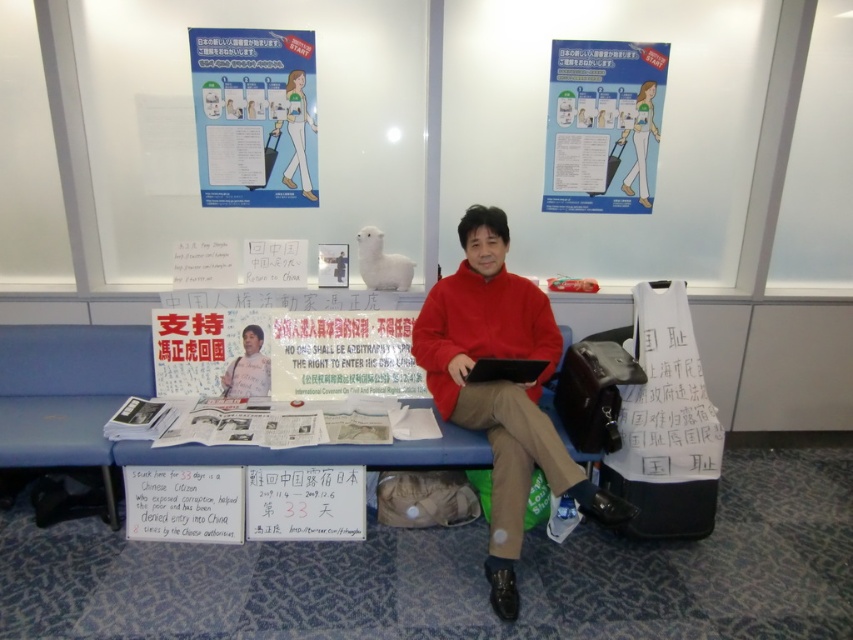
Question: Which is nearer to the blue paper poster at upper left?

Choices:
 (A) blue paper poster at upper center
 (B) matte red sweater at center
 (C) red fleece sweater at center

Answer: (B)

Question: Does red fleece sweater at center appear on the left side of matte red sweater at center?

Choices:
 (A) no
 (B) yes

Answer: (A)

Question: Is blue paper poster at upper left thinner than matte red sweater at center?

Choices:
 (A) no
 (B) yes

Answer: (A)

Question: Which point is farther to the camera?

Choices:
 (A) (200, 108)
 (B) (537, 380)
 (C) (242, 376)
 (D) (654, 147)

Answer: (D)

Question: Which of these objects is positioned farthest from the red fleece sweater at center?

Choices:
 (A) blue paper poster at upper left
 (B) blue paper poster at upper center

Answer: (A)

Question: Can you confirm if blue paper poster at upper left is positioned above blue paper poster at upper center?

Choices:
 (A) no
 (B) yes

Answer: (B)